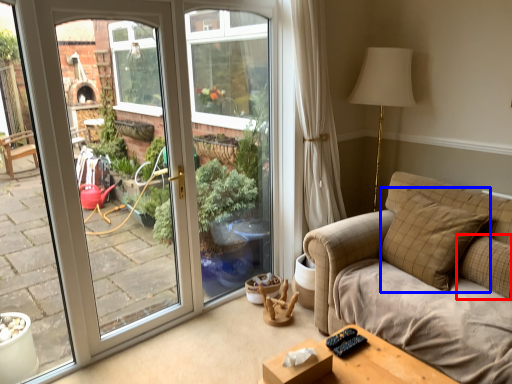
Question: Among these objects, which one is farthest to the camera, pillow (highlighted by a red box) or pillow (highlighted by a blue box)?

Choices:
 (A) pillow
 (B) pillow

Answer: (B)